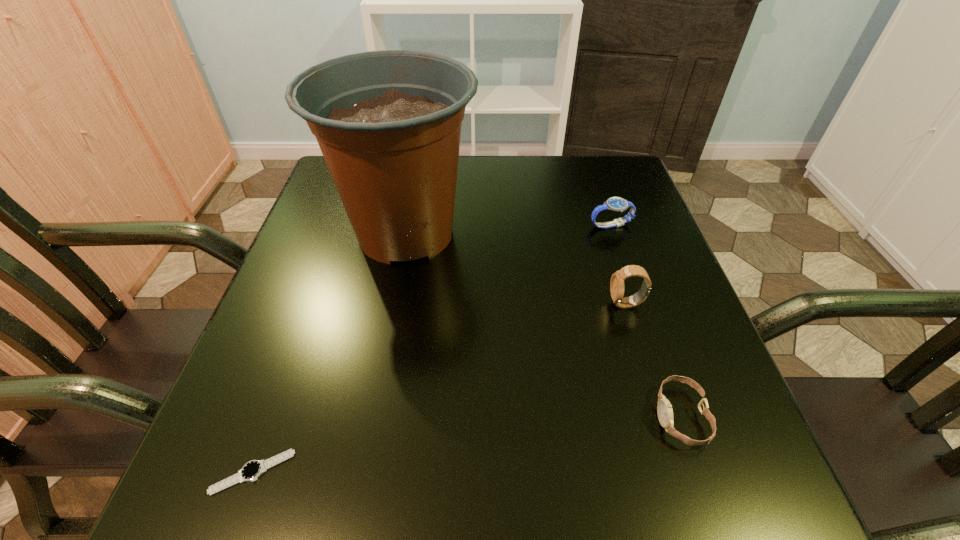
Where is `watch at the left edge`? This screenshot has height=540, width=960. watch at the left edge is located at coordinates (251, 471).

Locate an element on the screen. The height and width of the screenshot is (540, 960). object that is at the far left corner is located at coordinates (388, 123).

Where is `object situated at the near left corner`? This screenshot has height=540, width=960. object situated at the near left corner is located at coordinates (251, 471).

I want to click on vacant space at the far edge, so click(498, 169).

Where is `free space at the near edge of the desktop`? This screenshot has width=960, height=540. free space at the near edge of the desktop is located at coordinates (503, 497).

Locate an element on the screen. vacant area at the left edge is located at coordinates (233, 407).

In the image, there is a desktop. Identify the location of blank space at the right edge. The image size is (960, 540). (646, 343).

At what (x,y) coordinates should I click in order to perform the action: click on vacant space at the far left corner. Please return your answer as a coordinate pair (x, y). This screenshot has width=960, height=540. Looking at the image, I should click on point(330,186).

Image resolution: width=960 pixels, height=540 pixels. Identify the location of free space at the near left corner of the desktop. (188, 485).

Find the location of a particular element. The width and height of the screenshot is (960, 540). vacant space at the near right corner of the desktop is located at coordinates (754, 480).